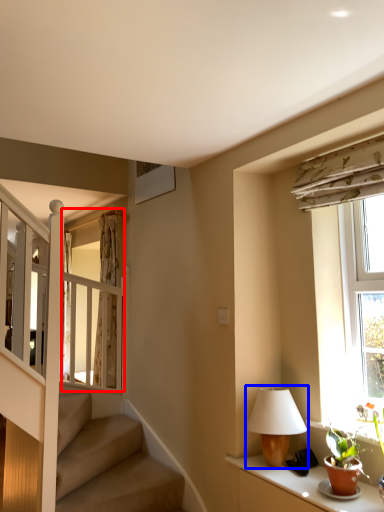
Question: Which object is closer to the camera taking this photo, glass door (highlighted by a red box) or table lamp (highlighted by a blue box)?

Choices:
 (A) glass door
 (B) table lamp

Answer: (B)